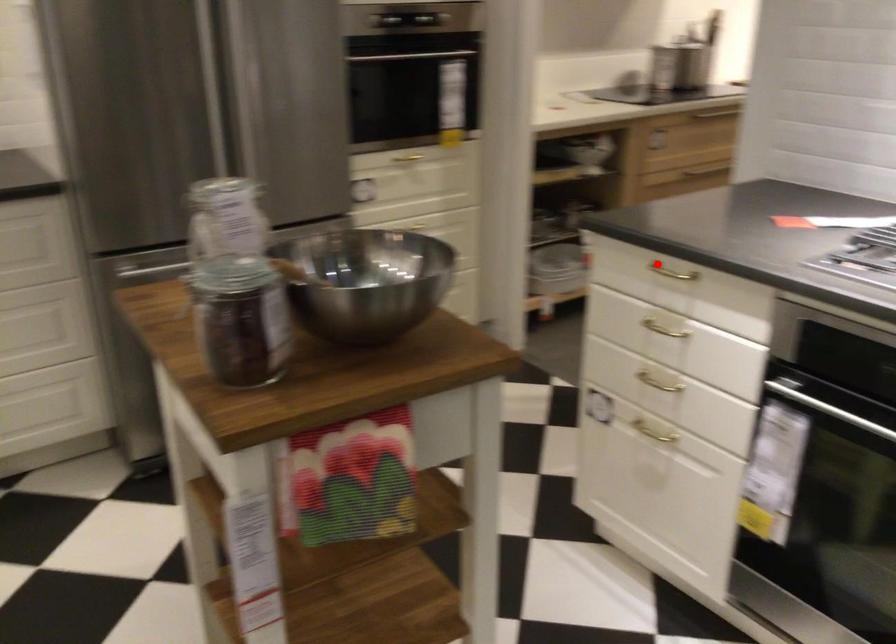
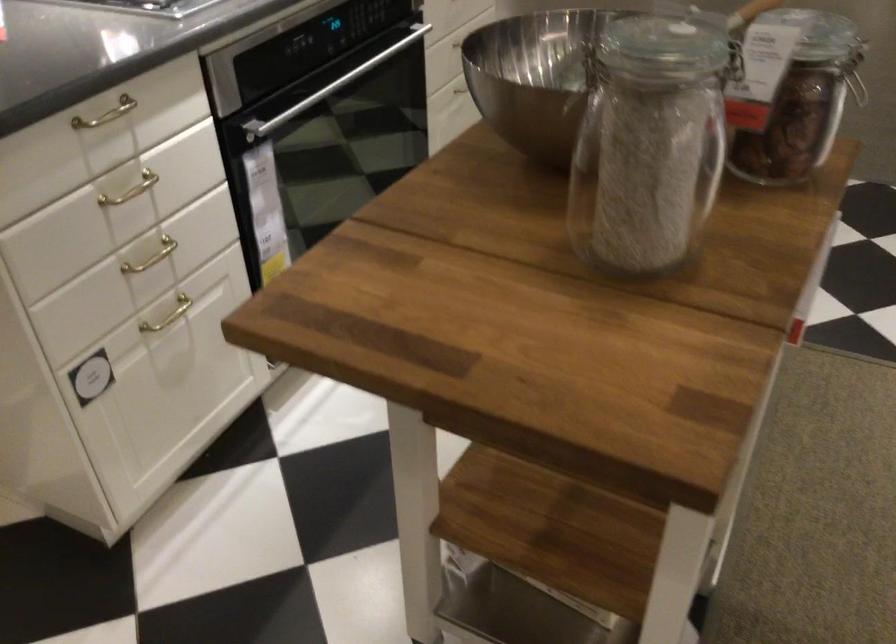
The point at the highlighted location is marked in the first image. Where is the corresponding point in the second image?

(106, 114)